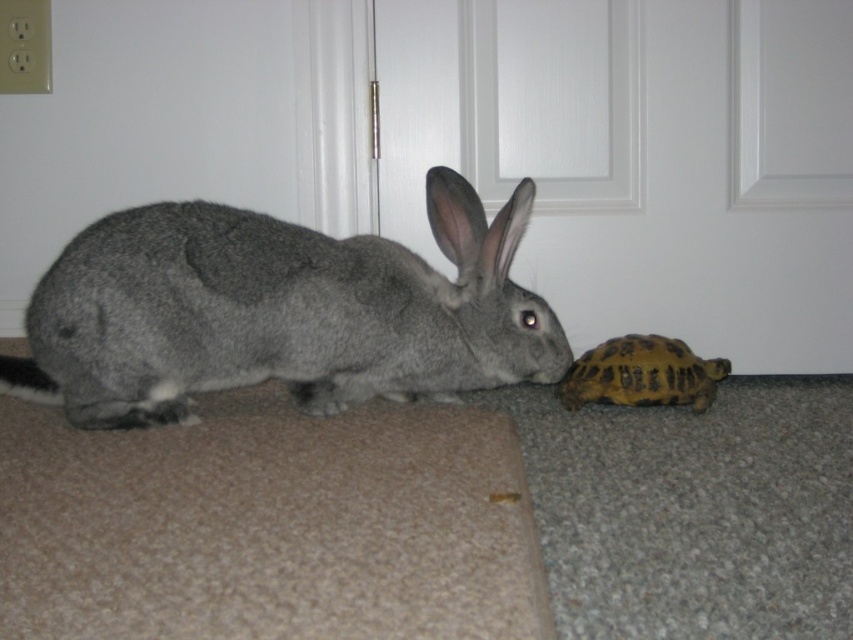
Does gray fur rabbit at left appear on the left side of yellow scaly tortoise at lower right?

Yes, gray fur rabbit at left is to the left of yellow scaly tortoise at lower right.

Is point (267, 356) in front of point (619, 404)?

Yes, it is in front of point (619, 404).

Image resolution: width=853 pixels, height=640 pixels. I want to click on gray fur rabbit at left, so click(279, 310).